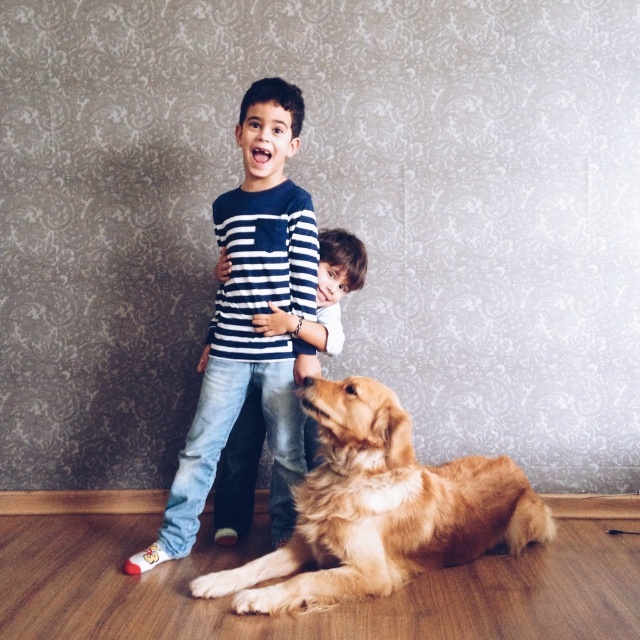
Based on the photo, can you confirm if golden fur dog at lower center is thinner than smooth golden dog at lower center?

In fact, golden fur dog at lower center might be wider than smooth golden dog at lower center.

Consider the image. Is golden fur dog at lower center bigger than smooth golden dog at lower center?

Correct, golden fur dog at lower center is larger in size than smooth golden dog at lower center.

Is point (408, 516) in front of point (323, 323)?

That is True.

In order to click on golden fur dog at lower center in this screenshot , I will do `click(380, 509)`.

Can you confirm if golden fur dog at lower center is positioned above striped cotton shirt at center?

Incorrect, golden fur dog at lower center is not positioned above striped cotton shirt at center.

Can you confirm if golden fur dog at lower center is thinner than striped cotton shirt at center?

No.

Is point (397, 577) farther from camera compared to point (250, 189)?

No, (397, 577) is in front of (250, 189).

This screenshot has height=640, width=640. I want to click on golden fur dog at lower center, so click(x=380, y=509).

Between striped cotton shirt at center and smooth golden dog at lower center, which one is positioned lower?

smooth golden dog at lower center is below.

Does point (248, 321) come behind point (333, 276)?

No, it is in front of (333, 276).

Image resolution: width=640 pixels, height=640 pixels. In order to click on striped cotton shirt at center in this screenshot , I will do `click(250, 321)`.